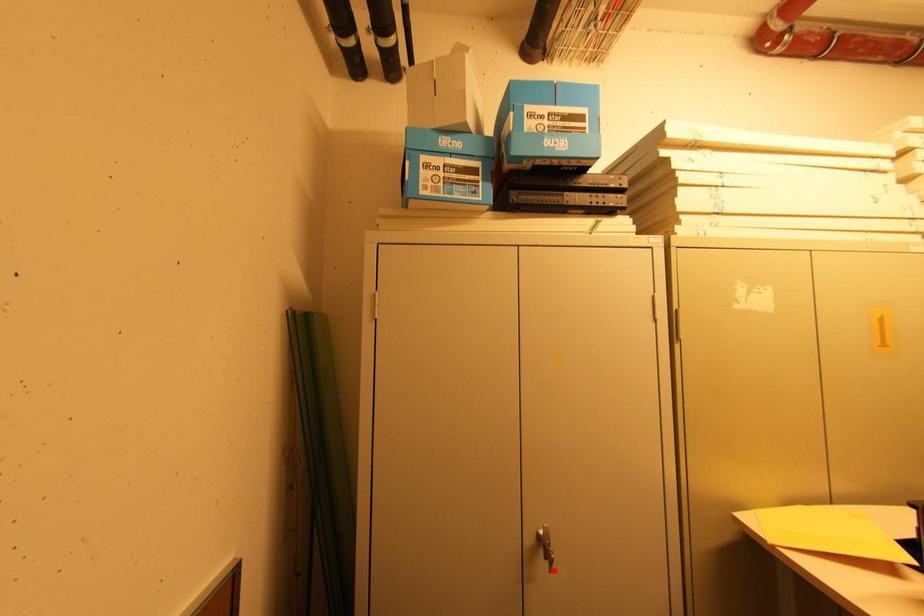
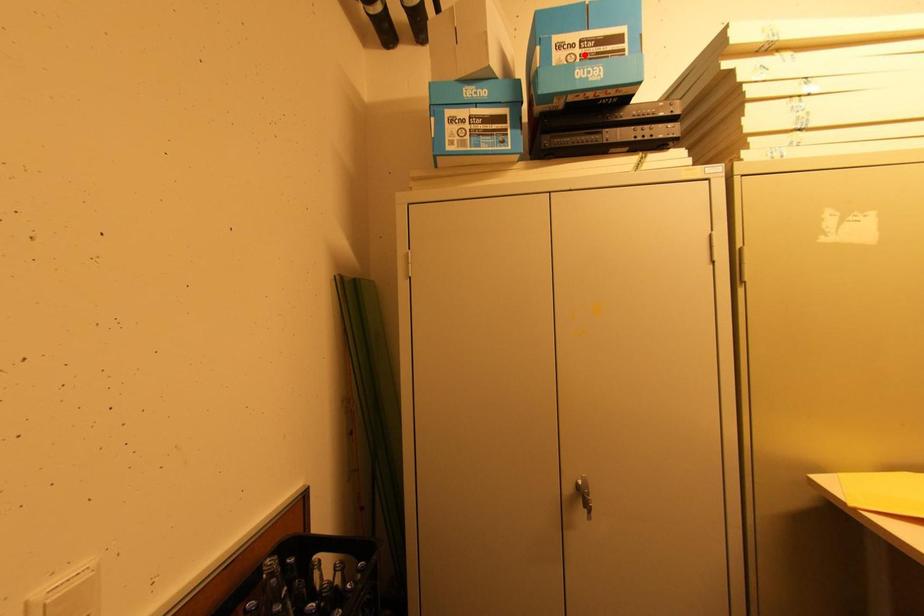
I am providing you with two images of the same scene from different viewpoints. A red point is marked on the first image and another point is marked on the second image. Does the point marked in image1 correspond to the same location as the one in image2?

No